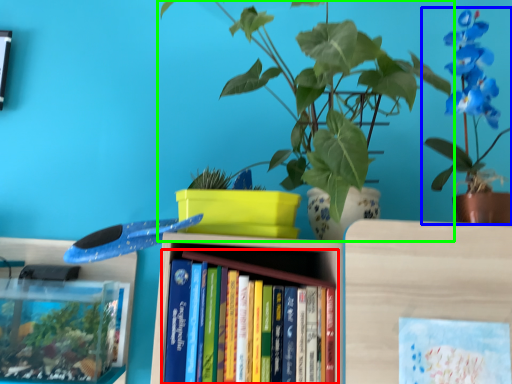
Question: Based on their relative distances, which object is farther from book (highlighted by a red box)? Choose from houseplant (highlighted by a blue box) and houseplant (highlighted by a green box).

Choices:
 (A) houseplant
 (B) houseplant

Answer: (A)